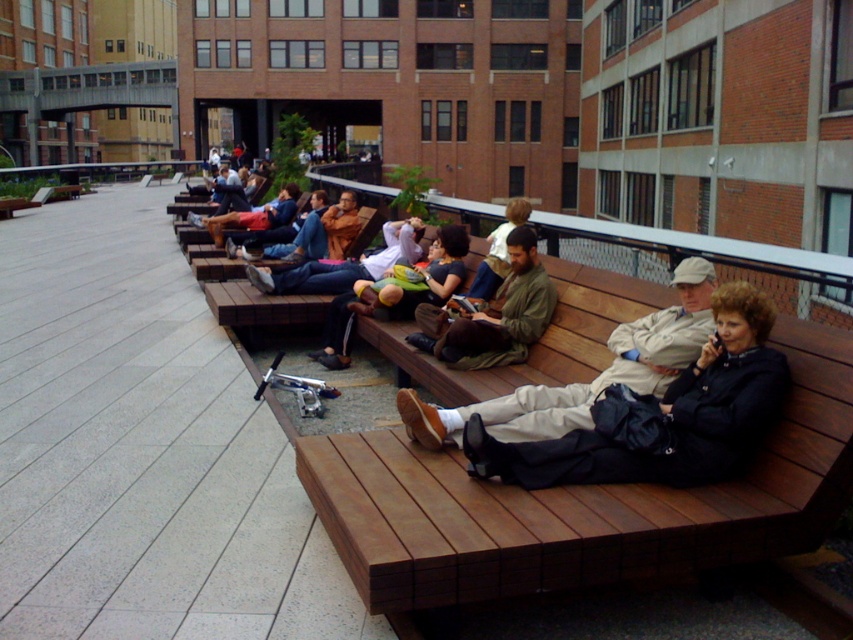
Is khaki cotton pants at center shorter than blue denim jeans at center?

Correct, khaki cotton pants at center is not as tall as blue denim jeans at center.

Locate an element on the screen. This screenshot has height=640, width=853. khaki cotton pants at center is located at coordinates (582, 381).

From the picture: Measure the distance between point (492, 429) and camera.

The distance of point (492, 429) from camera is 10.03 feet.

This screenshot has height=640, width=853. I want to click on khaki cotton pants at center, so click(582, 381).

Can you confirm if brown wooden bench at center is positioned below blue denim jeans at center?

Yes, brown wooden bench at center is below blue denim jeans at center.

Is point (560, 557) less distant than point (286, 237)?

Yes, it is.

Identify the location of brown wooden bench at center. (581, 502).

Where is `brown wooden bench at center`? brown wooden bench at center is located at coordinates (581, 502).

Where is `brown wooden bench at center`? The image size is (853, 640). brown wooden bench at center is located at coordinates (581, 502).

The height and width of the screenshot is (640, 853). What are the coordinates of `brown wooden bench at center` in the screenshot? It's located at (581, 502).